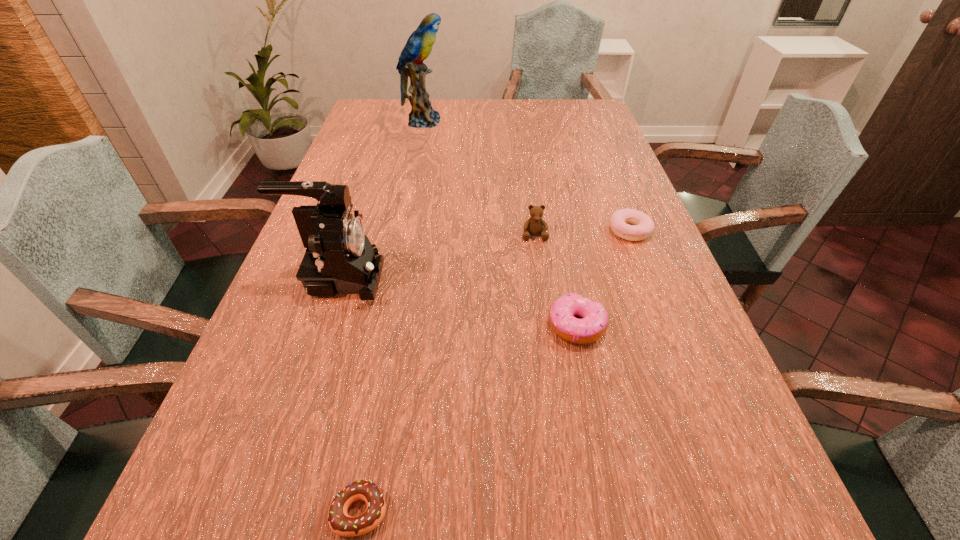
Identify the location of vacant space that satisfies the following two spatial constraints: 1. on the lens mount of the camcorder; 2. on the back side of the second farthest doughnut. The width and height of the screenshot is (960, 540). (324, 326).

This screenshot has width=960, height=540. I want to click on vacant point that satisfies the following two spatial constraints: 1. on the front side of the fifth tallest object; 2. on the lens mount of the fifth shortest object, so click(649, 278).

You are a GUI agent. You are given a task and a screenshot of the screen. Output one action in this format:
    pyautogui.click(x=<x>, y=<y>)
    Task: Click on the blank area in the image that satisfies the following two spatial constraints: 1. on the back side of the rightmost doughnut; 2. on the right side of the second doughnut from right to left
    Image resolution: width=960 pixels, height=540 pixels.
    Given the screenshot: What is the action you would take?
    pyautogui.click(x=557, y=231)

In order to click on free space that satisfies the following two spatial constraints: 1. on the back side of the rightmost doughnut; 2. on the face of the parrot in this screenshot , I will do `click(587, 122)`.